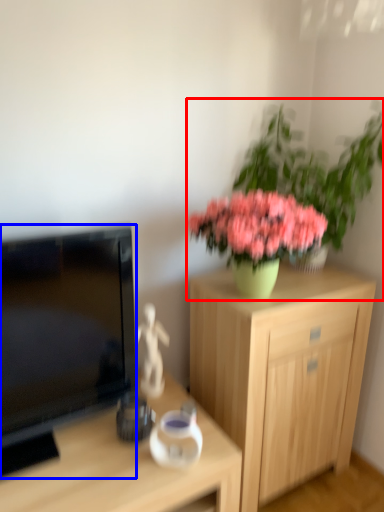
Question: Which of the following is the closest to the observer, houseplant (highlighted by a red box) or television (highlighted by a blue box)?

Choices:
 (A) houseplant
 (B) television

Answer: (B)